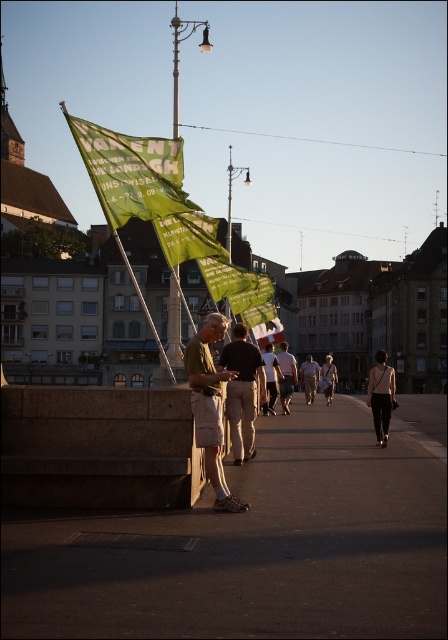
Which of these two, khaki shorts at center or light brown leather pants at center, stands taller?

Standing taller between the two is khaki shorts at center.

Who is positioned more to the left, khaki shorts at center or light brown leather pants at center?

khaki shorts at center

Who is more forward, (209, 404) or (280, 388)?

Positioned in front is point (209, 404).

At what (x,y) coordinates should I click in order to perform the action: click on khaki shorts at center. Please return your answer as a coordinate pair (x, y). The height and width of the screenshot is (640, 448). Looking at the image, I should click on (210, 406).

Can you confirm if khaki cotton shorts at center is positioned below dark gray pants at center?

No.

Who is shorter, khaki cotton shorts at center or dark gray pants at center?

dark gray pants at center is shorter.

Identify the location of khaki cotton shorts at center. (241, 392).

Is point (169, 205) farther from viewer compared to point (281, 378)?

No, (169, 205) is in front of (281, 378).

Who is lower down, green fabric banner at upper center or light brown leather pants at center?

light brown leather pants at center

Consider the image. Who is more forward, (99,179) or (287,378)?

Positioned in front is point (99,179).

At what (x,y) coordinates should I click in order to perform the action: click on green fabric banner at upper center. Please return your answer as a coordinate pair (x, y). The height and width of the screenshot is (640, 448). Looking at the image, I should click on (132, 172).